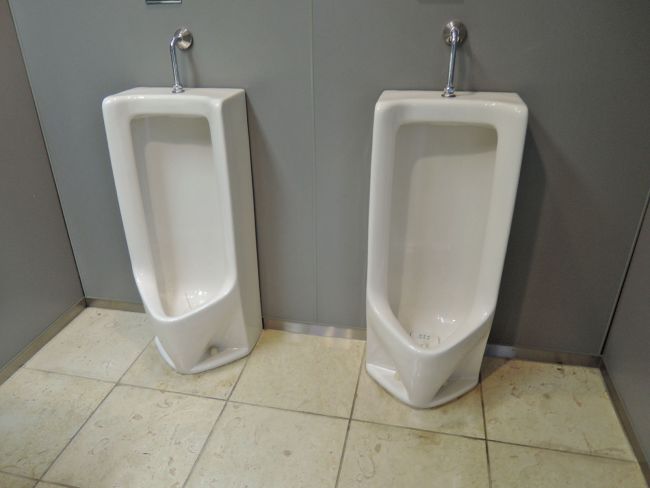
This screenshot has width=650, height=488. Find the location of `wall`. wall is located at coordinates (564, 216).